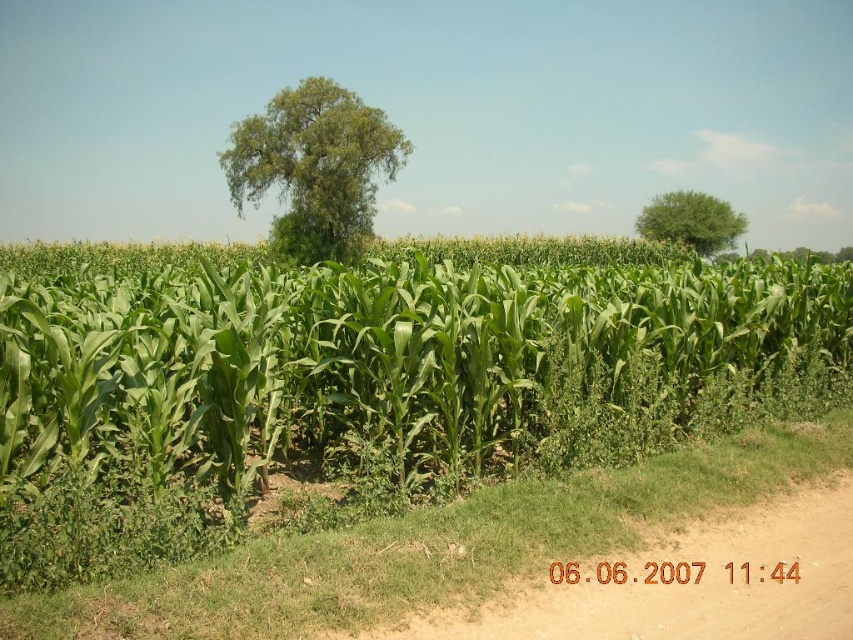
Question: Which object is positioned farthest from the green leafy tree at upper right?

Choices:
 (A) green leafy corn at center
 (B) green leafy tree at center

Answer: (B)

Question: Which of the following is the closest to the observer?

Choices:
 (A) (277, 221)
 (B) (567, 618)
 (C) (735, 221)
 (D) (621, 314)

Answer: (B)

Question: Considering the relative positions of green leafy corn at center and green leafy tree at center in the image provided, where is green leafy corn at center located with respect to green leafy tree at center?

Choices:
 (A) below
 (B) above

Answer: (A)

Question: Which point appears farthest from the camera in this image?

Choices:
 (A) (483, 298)
 (B) (370, 224)

Answer: (B)

Question: Is green leafy tree at center smaller than green leafy tree at upper right?

Choices:
 (A) yes
 (B) no

Answer: (B)

Question: Does green leafy corn at center lie behind brown dirt track at lower right?

Choices:
 (A) no
 (B) yes

Answer: (B)